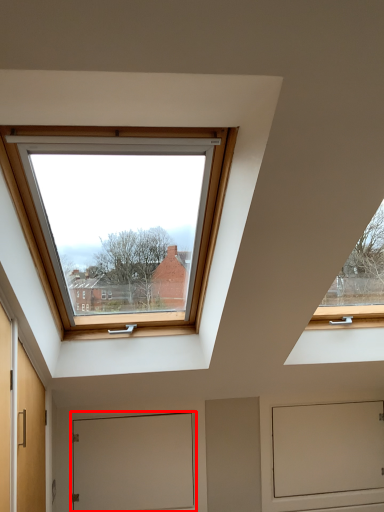
Question: From the image's perspective, where is door (annotated by the red box) located relative to screen door?

Choices:
 (A) above
 (B) below

Answer: (A)